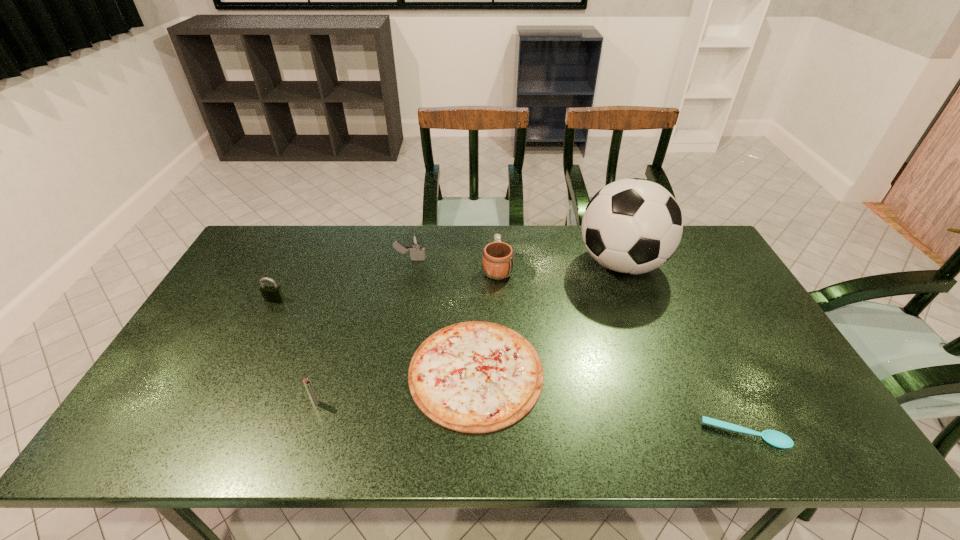
The height and width of the screenshot is (540, 960). I want to click on vacant region at the far left corner of the desktop, so click(x=252, y=241).

Locate an element on the screen. The width and height of the screenshot is (960, 540). vacant space at the near left corner of the desktop is located at coordinates (163, 418).

Find the location of a particular element. The height and width of the screenshot is (540, 960). vacant area between the pizza and the right igniter is located at coordinates pyautogui.click(x=444, y=316).

Find the location of a particular element. The width and height of the screenshot is (960, 540). vacant point located between the soccer ball and the mug is located at coordinates (559, 266).

The image size is (960, 540). Identify the location of vacant space that is in between the pizza and the mug. (487, 320).

This screenshot has width=960, height=540. Identify the location of free point between the pizza and the tallest object. (548, 318).

In order to click on vacant point located between the padlock and the right igniter in this screenshot , I will do `click(343, 280)`.

Image resolution: width=960 pixels, height=540 pixels. I want to click on unoccupied area between the nearer igniter and the pizza, so click(396, 387).

This screenshot has height=540, width=960. I want to click on free space between the sixth object from right to left and the leftmost object, so [295, 351].

This screenshot has height=540, width=960. I want to click on free spot between the fourth farthest object and the soccer ball, so click(448, 282).